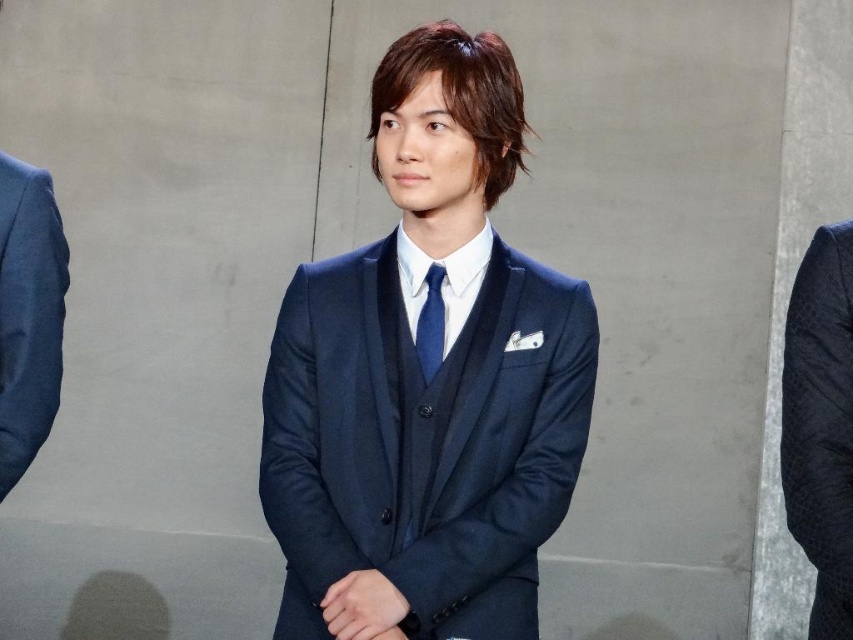
Can you confirm if navy blue suit at center is thinner than navy textured suit at center?

In fact, navy blue suit at center might be wider than navy textured suit at center.

Does navy blue suit at center have a larger size compared to navy textured suit at center?

Yes, navy blue suit at center is bigger than navy textured suit at center.

Measure the distance between navy blue suit at center and camera.

They are 5.62 feet apart.

Find the location of `navy blue suit at center`. navy blue suit at center is located at coordinates (422, 381).

Measure the distance between matte blue suit at left and matte blue tie at center.

matte blue suit at left and matte blue tie at center are 27.08 inches apart.

Between matte blue suit at left and matte blue tie at center, which one appears on the right side from the viewer's perspective?

matte blue tie at center is more to the right.

Image resolution: width=853 pixels, height=640 pixels. What do you see at coordinates (28, 314) in the screenshot?
I see `matte blue suit at left` at bounding box center [28, 314].

At what (x,y) coordinates should I click in order to perform the action: click on matte blue suit at left. Please return your answer as a coordinate pair (x, y). The image size is (853, 640). Looking at the image, I should click on (28, 314).

Between navy textured suit at center and matte blue suit at left, which one is positioned higher?

Positioned higher is matte blue suit at left.

Can you confirm if navy textured suit at center is positioned to the left of matte blue suit at left?

In fact, navy textured suit at center is to the right of matte blue suit at left.

Measure the distance between point [840,339] and camera.

A distance of 1.70 meters exists between point [840,339] and camera.

The image size is (853, 640). I want to click on navy textured suit at center, so click(x=820, y=424).